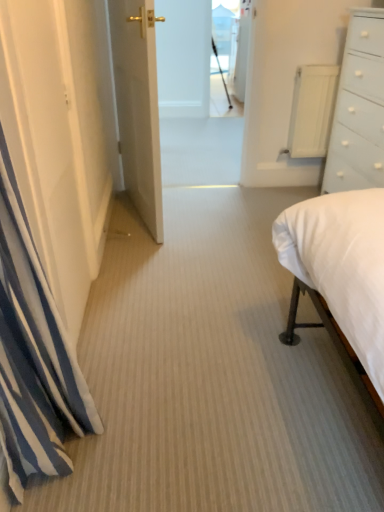
This screenshot has width=384, height=512. In order to click on vacant area that lies in front of white glossy door at center in this screenshot , I will do `click(170, 264)`.